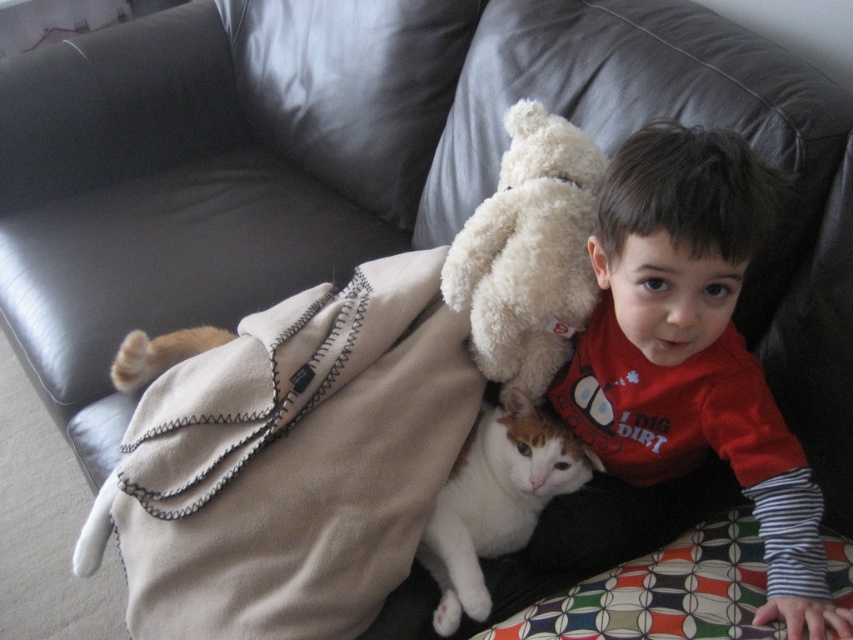
You are a photographer setting up a shoot in the living room. You need to position a large camera on the couch where the red cotton shirt at upper right and the white soft fur cat at lower center are currently located. Since the camera requires more space than both objects combined, will there be enough room on the couch to place the camera without moving either object?

The red cotton shirt at upper right is larger in size than the white soft fur cat at lower center. However, since the camera requires more space than both objects combined, there may not be enough room on the couch to place the camera without moving either object unless the couch has additional space available beyond the area occupied by these items.

You are a photographer setting up a shot of the red cotton shirt at upper right and the white soft fur cat at lower center. To ensure both subjects are in frame, which subject should you position closer to the camera to avoid cropping?

The red cotton shirt at upper right might be wider than the white soft fur cat at lower center, so you should position the red cotton shirt at upper right closer to the camera to ensure it fits within the frame without cropping.

You are a photographer trying to capture a closeup shot of the red cotton shirt at upper right and the white soft fur cat at lower center. What is the minimum distance you need to set your camera lens to focus on both subjects clearly?

The minimum distance required is 6.59 inches because the red cotton shirt at upper right is only 6.59 inches away from the white soft fur cat at lower center, so focusing at that distance will ensure both are in clear view.